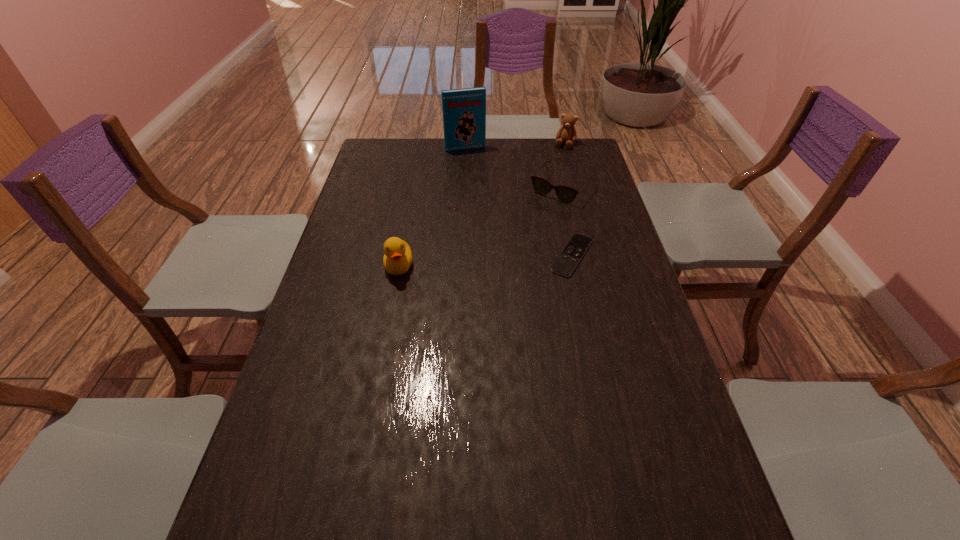
You are a GUI agent. You are given a task and a screenshot of the screen. Output one action in this format:
    pyautogui.click(x=<x>, y=<y>)
    Task: Click on the duckling
    
    Given the screenshot: What is the action you would take?
    pyautogui.click(x=397, y=259)

The image size is (960, 540). I want to click on remote control, so click(567, 261).

You are a GUI agent. You are given a task and a screenshot of the screen. Output one action in this format:
    pyautogui.click(x=<x>, y=<y>)
    Task: Click on the teddy bear
    The width and height of the screenshot is (960, 540).
    Given the screenshot: What is the action you would take?
    pyautogui.click(x=567, y=133)

At what (x,y) coordinates should I click in order to perform the action: click on the third farthest object. Please return your answer as a coordinate pair (x, y). Looking at the image, I should click on (566, 194).

This screenshot has width=960, height=540. What are the coordinates of `spectacles` in the screenshot? It's located at (566, 194).

The height and width of the screenshot is (540, 960). I want to click on the second object from left to right, so click(464, 110).

The image size is (960, 540). Find the location of `the tallest object`. the tallest object is located at coordinates (464, 110).

You are a GUI agent. You are given a task and a screenshot of the screen. Output one action in this format:
    pyautogui.click(x=<x>, y=<y>)
    Task: Click on the vacant space located on the face of the duckling
    
    Given the screenshot: What is the action you would take?
    pyautogui.click(x=386, y=333)

The image size is (960, 540). In order to click on vacant space located on the back of the shortest object in this screenshot , I will do `click(560, 199)`.

Where is `free space located on the face of the teddy bear`? This screenshot has width=960, height=540. free space located on the face of the teddy bear is located at coordinates (547, 179).